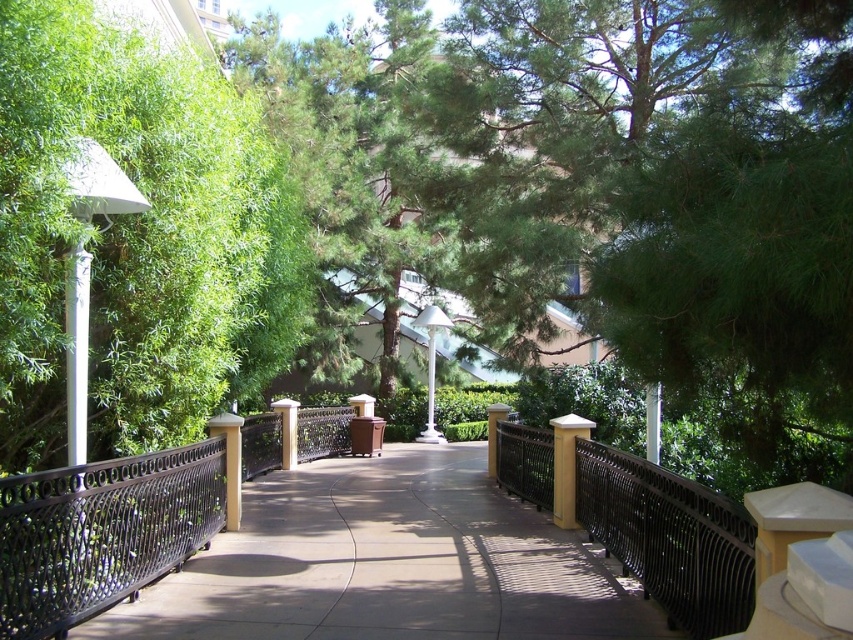
Is concrete pavement at center above black wrought iron fence at center?

Actually, concrete pavement at center is below black wrought iron fence at center.

Is concrete pavement at center positioned before black wrought iron fence at center?

No, concrete pavement at center is behind black wrought iron fence at center.

Image resolution: width=853 pixels, height=640 pixels. What are the coordinates of `concrete pavement at center` in the screenshot? It's located at pyautogui.click(x=389, y=563).

Between wooden post at center and white glossy pole at center, which one has less height?

With less height is wooden post at center.

Does wooden post at center appear on the left side of white glossy pole at center?

In fact, wooden post at center is to the right of white glossy pole at center.

Who is more distant from viewer, (563, 461) or (430, 342)?

Positioned behind is point (430, 342).

Where is `wooden post at center`? This screenshot has width=853, height=640. wooden post at center is located at coordinates (566, 465).

Is point (177, 508) positioned behind point (432, 349)?

No, (177, 508) is closer to viewer.

Is brown wrought iron fence at center positioned in front of white glossy pole at center?

Yes, brown wrought iron fence at center is in front of white glossy pole at center.

Is point (97, 609) closer to camera compared to point (430, 339)?

Yes, it is in front of point (430, 339).

The height and width of the screenshot is (640, 853). I want to click on brown wrought iron fence at center, so click(x=102, y=532).